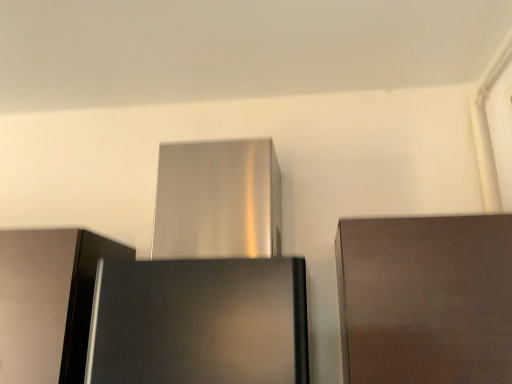
In order to click on brown matte cabinet at right in this screenshot , I will do `click(425, 299)`.

In order to face brown matte cabinet at right, should I rotate leftwards or rightwards?

Turn right by 23.774 degrees to look at brown matte cabinet at right.

This screenshot has height=384, width=512. Describe the element at coordinates (425, 299) in the screenshot. I see `brown matte cabinet at right` at that location.

Locate an element on the screen. This screenshot has width=512, height=384. brown matte cabinet at right is located at coordinates (425, 299).